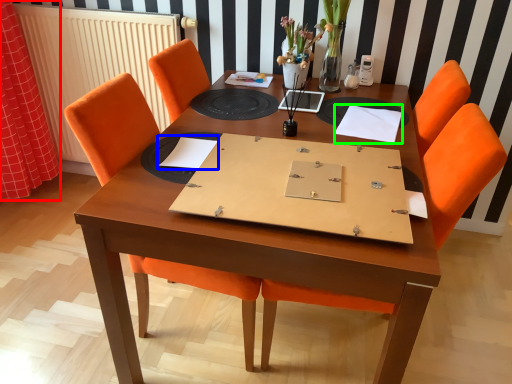
Question: Considering the real-world distances, which object is closest to curtain (highlighted by a red box)? notebook (highlighted by a blue box) or notebook (highlighted by a green box).

Choices:
 (A) notebook
 (B) notebook

Answer: (A)